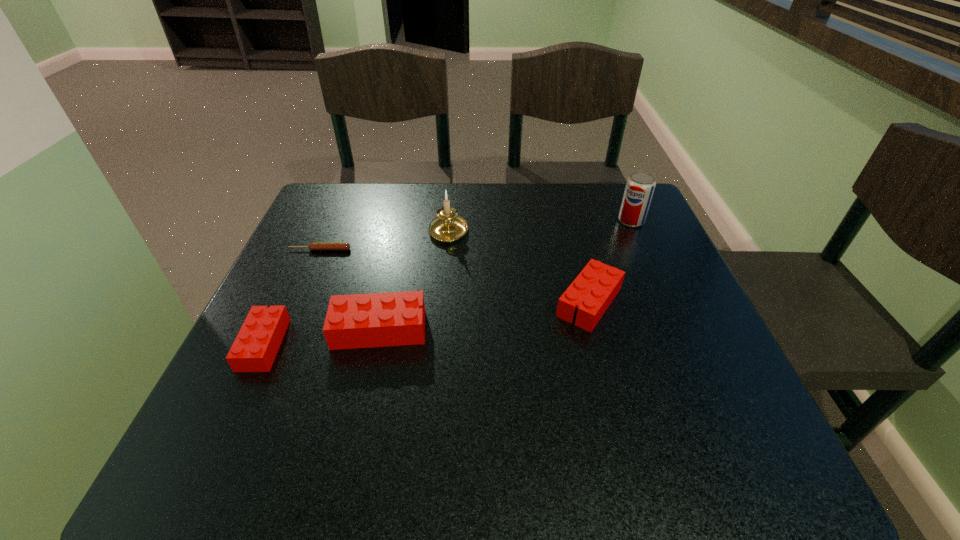
Where is `vacant space situated on the back of the second Lego from right to left`? This screenshot has height=540, width=960. vacant space situated on the back of the second Lego from right to left is located at coordinates click(398, 244).

Where is `vacant point located 0.110m on the back of the rightmost Lego`? This screenshot has height=540, width=960. vacant point located 0.110m on the back of the rightmost Lego is located at coordinates (574, 245).

You are a GUI agent. You are given a task and a screenshot of the screen. Output one action in this format:
    pyautogui.click(x=<x>, y=<y>)
    Task: Click on the vacant area situated on the left of the soda
    
    Given the screenshot: What is the action you would take?
    pyautogui.click(x=472, y=221)

Identify the location of vacant space located 0.090m on the handle side of the candle holder. This screenshot has height=540, width=960. (451, 195).

Where is `vacant position located on the handle side of the candle holder`? The height and width of the screenshot is (540, 960). vacant position located on the handle side of the candle holder is located at coordinates (452, 190).

I want to click on vacant region located 0.350m on the front of the shortest object, so click(265, 378).

The height and width of the screenshot is (540, 960). In order to click on soda at the far edge in this screenshot , I will do `click(640, 185)`.

Image resolution: width=960 pixels, height=540 pixels. I want to click on candle holder that is at the far edge, so click(x=448, y=226).

You are a GUI agent. You are given a task and a screenshot of the screen. Output one action in this format:
    pyautogui.click(x=<x>, y=<y>)
    Task: Click on the sausage located at the left edge
    The height and width of the screenshot is (540, 960).
    Given the screenshot: What is the action you would take?
    pyautogui.click(x=336, y=246)

You are a GUI agent. You are given a task and a screenshot of the screen. Output one action in this format:
    pyautogui.click(x=<x>, y=<y>)
    Task: Click on the Lego that is at the right edge
    This screenshot has width=960, height=540.
    Given the screenshot: What is the action you would take?
    pyautogui.click(x=593, y=290)